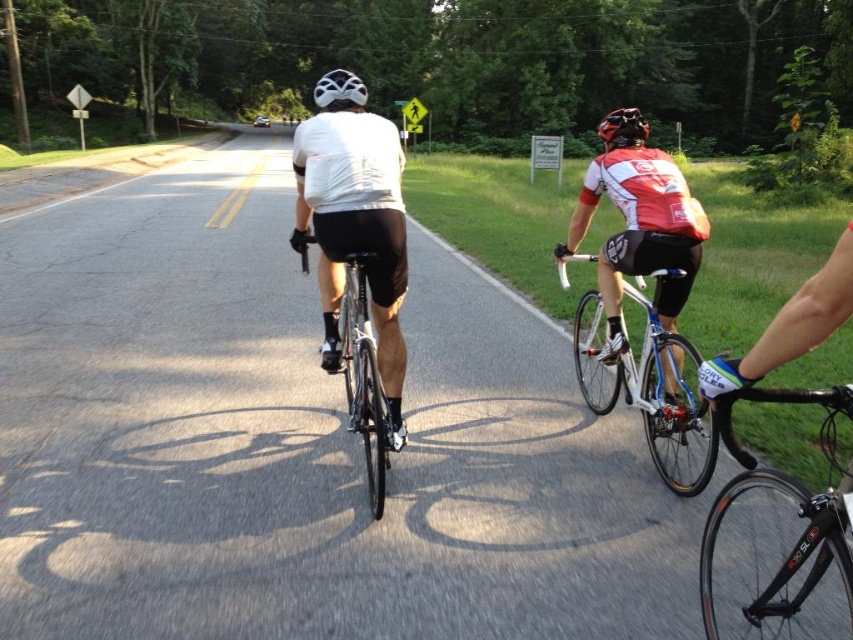
Can you confirm if shiny black frame at lower right is shorter than black matte helmet at upper center?

Yes, shiny black frame at lower right is shorter than black matte helmet at upper center.

Can you confirm if shiny black frame at lower right is positioned to the right of black matte helmet at upper center?

No, shiny black frame at lower right is not to the right of black matte helmet at upper center.

Which is in front, point (747, 397) or point (643, 122)?

Point (747, 397)

Identify the location of shiny black frame at lower right. The height and width of the screenshot is (640, 853). (793, 499).

Is white jersey at center to the left of shiny silver bicycle at center from the viewer's perspective?

In fact, white jersey at center is to the right of shiny silver bicycle at center.

Who is more forward, [660,305] or [625,376]?

Point [660,305] is in front.

I want to click on white jersey at center, so click(x=639, y=232).

Between black matte helmet at upper center and white matte bicycle helmet at upper center, which one appears on the right side from the viewer's perspective?

black matte helmet at upper center

Does black matte helmet at upper center have a greater width compared to white matte bicycle helmet at upper center?

Yes, black matte helmet at upper center is wider than white matte bicycle helmet at upper center.

Which is behind, point (606, 125) or point (318, 100)?

Point (606, 125)

Where is `black matte helmet at upper center`? black matte helmet at upper center is located at coordinates (622, 129).